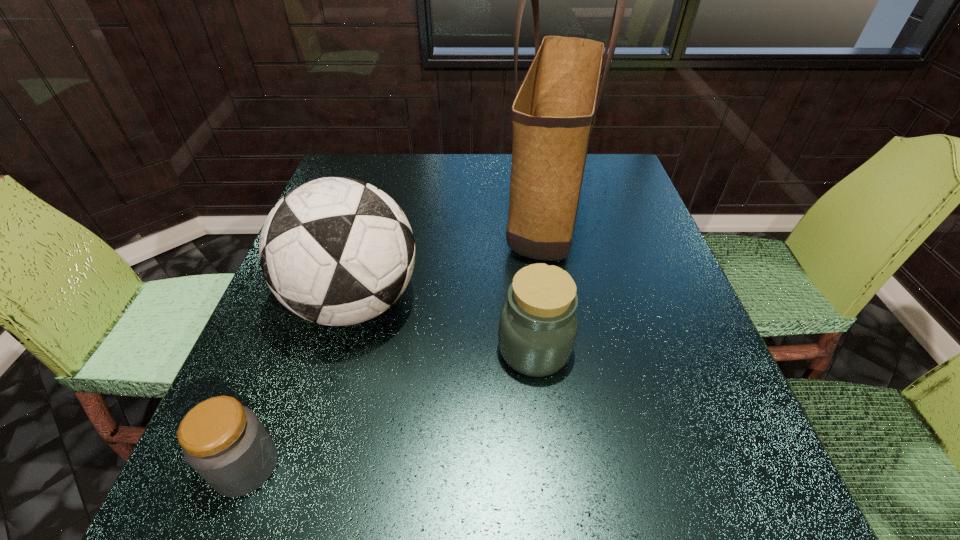
Find the location of a particular element. tote bag is located at coordinates (553, 114).

Find the location of a particular element. This screenshot has width=960, height=540. the second tallest object is located at coordinates (336, 251).

What are the coordinates of `the taller jar` in the screenshot? It's located at (538, 324).

Image resolution: width=960 pixels, height=540 pixels. I want to click on the farther jar, so click(x=538, y=324).

The image size is (960, 540). In order to click on the shorter jar in this screenshot , I will do 224,442.

The width and height of the screenshot is (960, 540). I want to click on the left jar, so 224,442.

This screenshot has width=960, height=540. In order to click on vacant space located 0.180m on the left of the tote bag in this screenshot , I will do `click(434, 210)`.

At what (x,y) coordinates should I click in order to perform the action: click on free location located on the surface of the soccer ball where the brand logo is visible. Please return your answer as a coordinate pair (x, y). Image resolution: width=960 pixels, height=540 pixels. Looking at the image, I should click on (612, 302).

Where is `free space located 0.400m on the left of the second shortest object`? free space located 0.400m on the left of the second shortest object is located at coordinates coord(287,350).

The image size is (960, 540). What are the coordinates of `free space located on the surface of the nearest object near the warning symbol` in the screenshot? It's located at (395, 466).